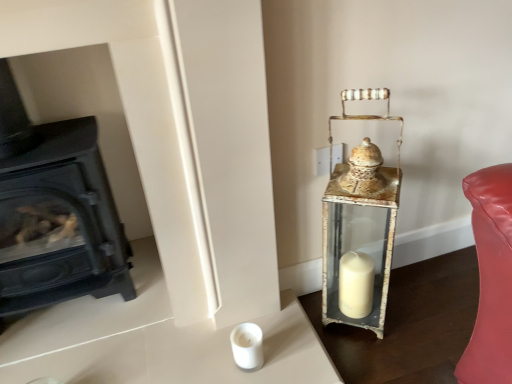
Question: Does antique brass lantern at right have a lesser width compared to black matte wood burning stove at left?

Choices:
 (A) no
 (B) yes

Answer: (B)

Question: Is the depth of antique brass lantern at right less than that of black matte wood burning stove at left?

Choices:
 (A) yes
 (B) no

Answer: (B)

Question: From the image's perspective, is antique brass lantern at right on top of black matte wood burning stove at left?

Choices:
 (A) no
 (B) yes

Answer: (A)

Question: Can you confirm if antique brass lantern at right is wider than black matte wood burning stove at left?

Choices:
 (A) no
 (B) yes

Answer: (A)

Question: Is antique brass lantern at right turned away from black matte wood burning stove at left?

Choices:
 (A) yes
 (B) no

Answer: (B)

Question: From a real-world perspective, does antique brass lantern at right sit lower than black matte wood burning stove at left?

Choices:
 (A) yes
 (B) no

Answer: (A)

Question: From a real-world perspective, is black matte wood burning stove at left under antique brass lantern at right?

Choices:
 (A) no
 (B) yes

Answer: (A)

Question: Is black matte wood burning stove at left positioned with its back to antique brass lantern at right?

Choices:
 (A) yes
 (B) no

Answer: (B)

Question: From the image's perspective, is black matte wood burning stove at left over antique brass lantern at right?

Choices:
 (A) no
 (B) yes

Answer: (B)

Question: Is black matte wood burning stove at left further to camera compared to antique brass lantern at right?

Choices:
 (A) yes
 (B) no

Answer: (B)

Question: Is black matte wood burning stove at left facing towards antique brass lantern at right?

Choices:
 (A) yes
 (B) no

Answer: (B)

Question: Is the surface of black matte wood burning stove at left in direct contact with antique brass lantern at right?

Choices:
 (A) no
 (B) yes

Answer: (A)

Question: Is point (335, 278) closer or farther from the camera than point (101, 185)?

Choices:
 (A) farther
 (B) closer

Answer: (B)